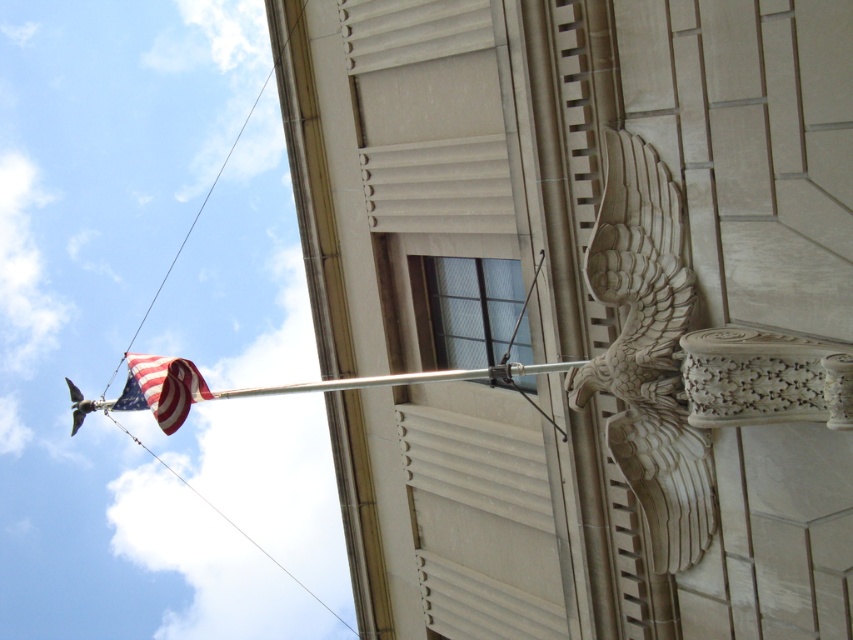
Question: Is carved stone eagle at upper right thinner than american flag at upper left?

Choices:
 (A) no
 (B) yes

Answer: (B)

Question: Does carved stone eagle at upper right have a greater width compared to american flag at upper left?

Choices:
 (A) no
 (B) yes

Answer: (A)

Question: Which point is closer to the camera?

Choices:
 (A) (635, 451)
 (B) (126, 387)

Answer: (A)

Question: Is carved stone eagle at upper right smaller than american flag at upper left?

Choices:
 (A) yes
 (B) no

Answer: (B)